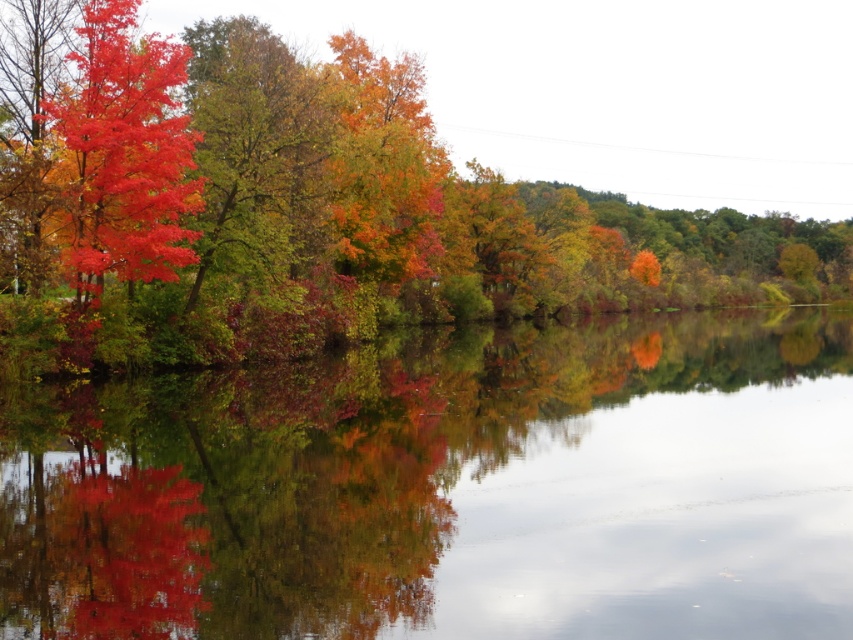
Can you confirm if transparent glass water at center is shorter than matte red tree at lower left?

In fact, transparent glass water at center may be taller than matte red tree at lower left.

What do you see at coordinates (448, 488) in the screenshot? This screenshot has width=853, height=640. I see `transparent glass water at center` at bounding box center [448, 488].

Identify the location of transparent glass water at center. Image resolution: width=853 pixels, height=640 pixels. (448, 488).

Between transparent glass water at center and matte red leaves at left, which one is positioned higher?

matte red leaves at left is above.

Is transparent glass water at center to the left of matte red leaves at left from the viewer's perspective?

Incorrect, transparent glass water at center is not on the left side of matte red leaves at left.

You are a GUI agent. You are given a task and a screenshot of the screen. Output one action in this format:
    pyautogui.click(x=<x>, y=<y>)
    Task: Click on the transparent glass water at center
    The image size is (853, 640).
    Given the screenshot: What is the action you would take?
    pyautogui.click(x=448, y=488)

You are a GUI agent. You are given a task and a screenshot of the screen. Output one action in this format:
    pyautogui.click(x=<x>, y=<y>)
    Task: Click on the transparent glass water at center
    
    Given the screenshot: What is the action you would take?
    pyautogui.click(x=448, y=488)

Is point (595, 202) positioned after point (102, 461)?

Yes, point (595, 202) is behind point (102, 461).

Which is below, shiny red leaves at left or matte red tree at lower left?

matte red tree at lower left is lower down.

Locate an element on the screen. This screenshot has height=640, width=853. shiny red leaves at left is located at coordinates (305, 205).

This screenshot has width=853, height=640. Find the location of `shiny red leaves at left`. shiny red leaves at left is located at coordinates (305, 205).